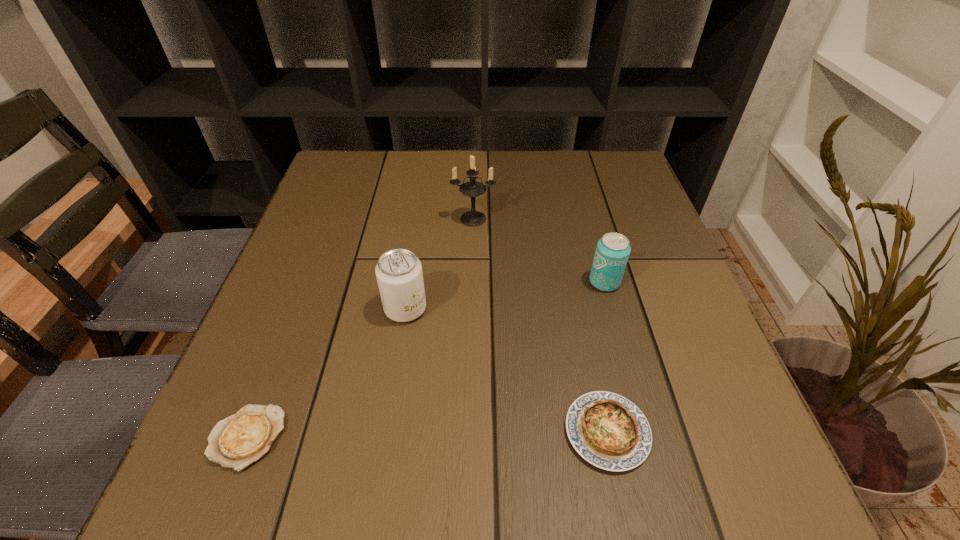
Find the location of `vacant area situated 0.240m on the front of the third farthest object`. vacant area situated 0.240m on the front of the third farthest object is located at coordinates (383, 455).

Where is `vacant region located 0.070m on the front of the second farthest object`? The width and height of the screenshot is (960, 540). vacant region located 0.070m on the front of the second farthest object is located at coordinates (615, 321).

Find the location of `vacant space located 0.080m on the left of the taller quiche`. vacant space located 0.080m on the left of the taller quiche is located at coordinates (513, 432).

Locate an element on the screen. Image resolution: width=960 pixels, height=540 pixels. free space located 0.130m on the right of the shortest object is located at coordinates (370, 437).

In order to click on object present at the left edge in this screenshot , I will do `click(239, 440)`.

The width and height of the screenshot is (960, 540). Identify the location of beer can at the right edge. (612, 252).

Where is `quiche that is at the right edge`? quiche that is at the right edge is located at coordinates (609, 431).

I want to click on object positioned at the near left corner, so click(x=239, y=440).

At what (x,y) coordinates should I click in order to perform the action: click on object that is at the near right corner. Please return your answer as a coordinate pair (x, y). Looking at the image, I should click on (609, 431).

The image size is (960, 540). What are the coordinates of `vacant region at the far edge of the desktop` in the screenshot? It's located at (533, 172).